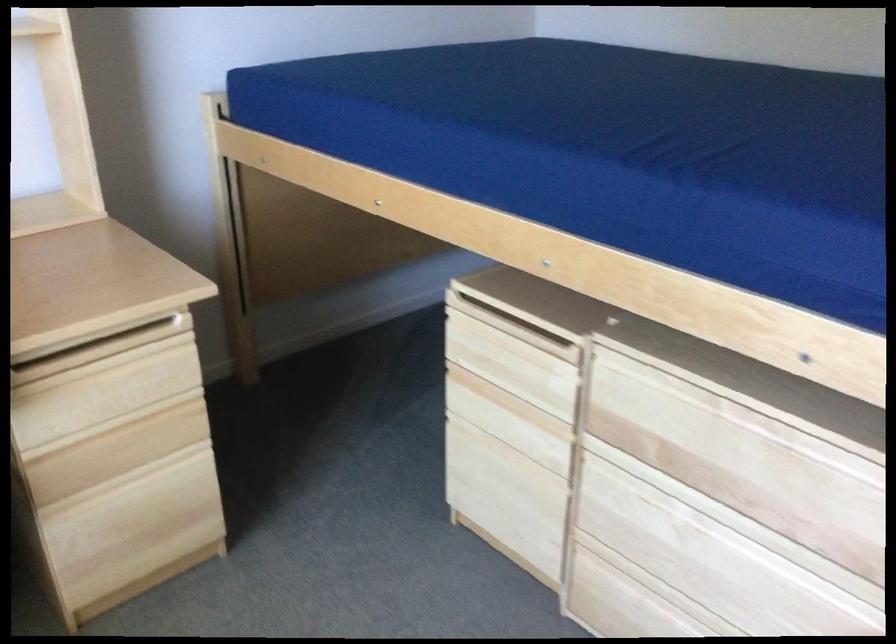
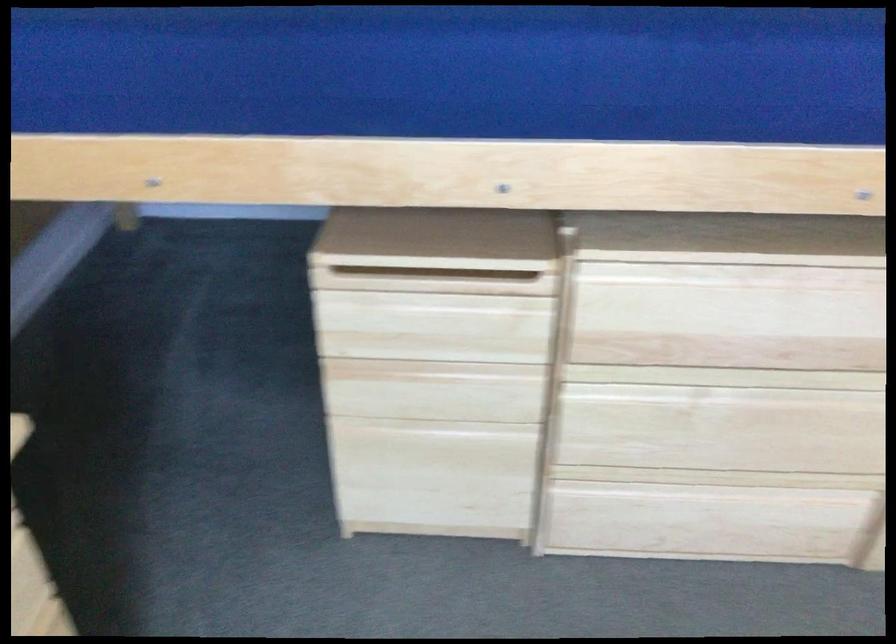
Where in the second image is the point corresponding to [510,323] from the first image?

(432, 279)